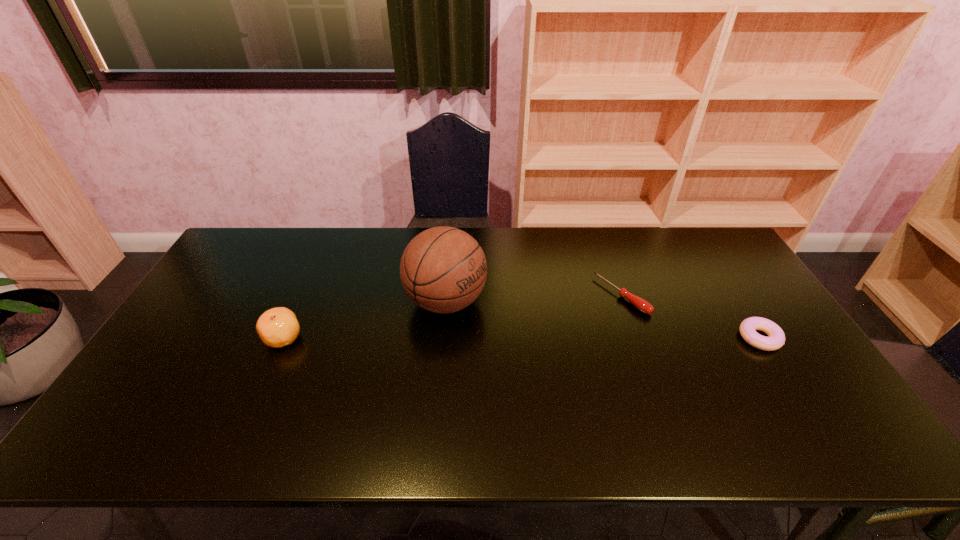
Where is `free spot located at the tip of the screwdriver`? The height and width of the screenshot is (540, 960). free spot located at the tip of the screwdriver is located at coordinates (588, 321).

Locate an element on the screen. free space located 0.210m on the side with brand label of the second object from left to right is located at coordinates (541, 352).

The height and width of the screenshot is (540, 960). Find the location of `vacant region located 0.070m on the side with brand label of the second object from left to right`. vacant region located 0.070m on the side with brand label of the second object from left to right is located at coordinates (498, 329).

At what (x,y) coordinates should I click in order to perform the action: click on free location located on the side with brand label of the second object from left to right. Please return your answer as a coordinate pair (x, y). Looking at the image, I should click on (511, 335).

The image size is (960, 540). I want to click on object at the right edge, so click(776, 339).

Identify the location of vacant space at the far edge of the desktop. (355, 250).

In the image, there is a desktop. Identify the location of vacant space at the near edge. (684, 394).

Image resolution: width=960 pixels, height=540 pixels. In order to click on blank space at the left edge of the desktop in this screenshot , I will do `click(214, 314)`.

You are a GUI agent. You are given a task and a screenshot of the screen. Output one action in this format:
    pyautogui.click(x=<x>, y=<y>)
    Task: Click on the free region at the right edge of the desktop
    Image resolution: width=960 pixels, height=540 pixels.
    Given the screenshot: What is the action you would take?
    coord(732,303)

In order to click on vacant region at the far left corner of the desktop in this screenshot , I will do tap(240, 248).